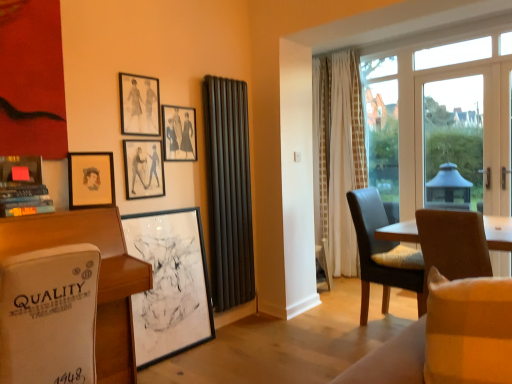
I want to click on vacant space underneath matte black radiator at center, the 1th curtain positioned from the front (from a real-world perspective), so click(x=238, y=315).